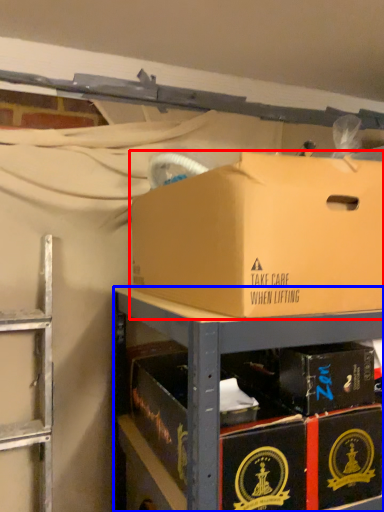
Question: Which point is further to the camera, box (highlighted by a red box) or shelf (highlighted by a blue box)?

Choices:
 (A) box
 (B) shelf

Answer: (B)